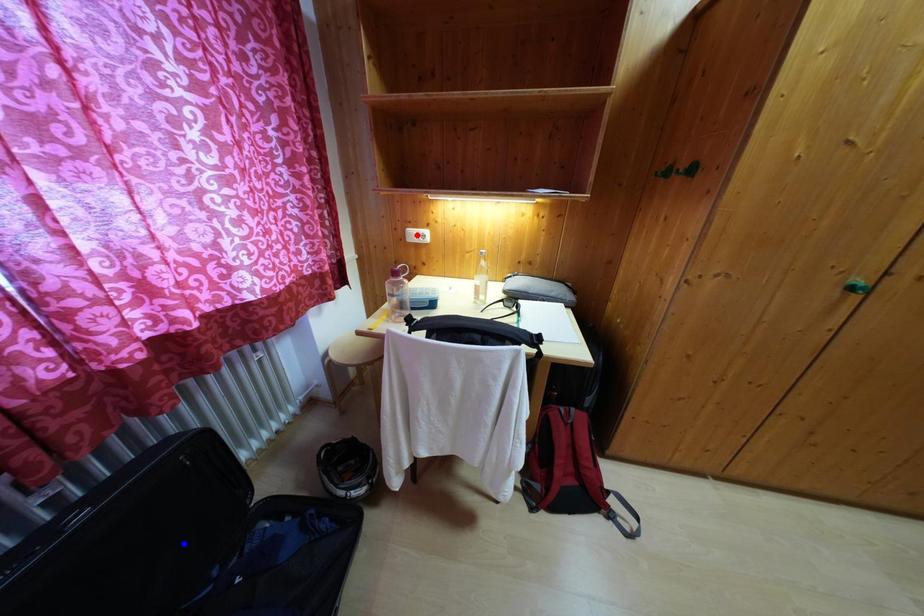
Question: Two points are marked on the image. Which point is closer to the camera?

Choices:
 (A) Blue point is closer.
 (B) Red point is closer.

Answer: (A)